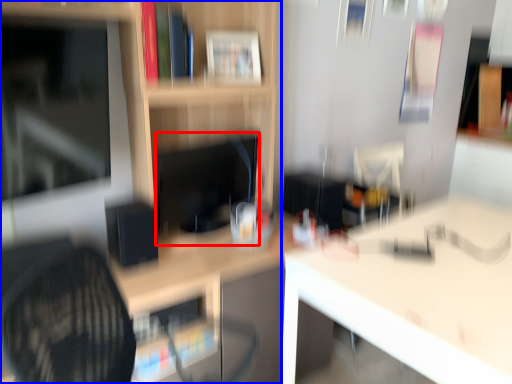
Question: Which object is closer to the camera taking this photo, computer monitor (highlighted by a red box) or shelf (highlighted by a blue box)?

Choices:
 (A) computer monitor
 (B) shelf

Answer: (B)